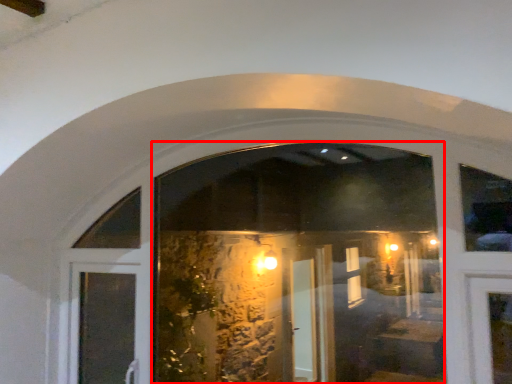
Question: From the image, what is the correct spatial relationship of shop window (annotated by the red box) in relation to door?

Choices:
 (A) right
 (B) left

Answer: (A)